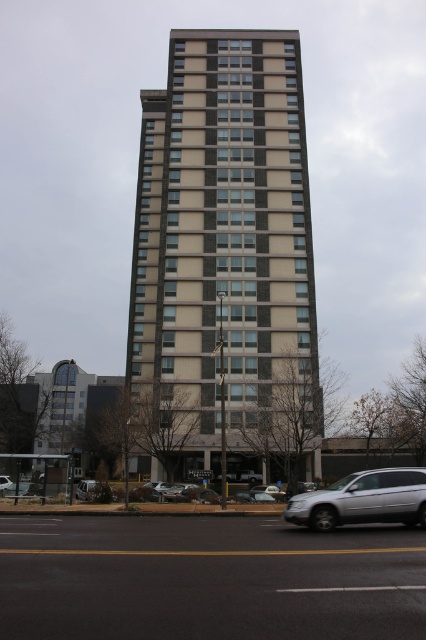
Which is below, metallic silver sedan at lower center or silver metallic suv at lower left?

Positioned lower is metallic silver sedan at lower center.

Can you confirm if metallic silver sedan at lower center is positioned above silver metallic suv at lower left?

No.

What do you see at coordinates (94, 490) in the screenshot? The image size is (426, 640). I see `metallic silver sedan at lower center` at bounding box center [94, 490].

Where is `metallic silver sedan at lower center`? The image size is (426, 640). metallic silver sedan at lower center is located at coordinates coord(94,490).

This screenshot has height=640, width=426. Describe the element at coordinates (362, 499) in the screenshot. I see `silver metallic suv at lower right` at that location.

Between silver metallic suv at lower right and silver metallic suv at lower left, which one has less height?

silver metallic suv at lower left

Describe the element at coordinates (362, 499) in the screenshot. I see `silver metallic suv at lower right` at that location.

This screenshot has height=640, width=426. Find the location of `silver metallic suv at lower right`. silver metallic suv at lower right is located at coordinates (362, 499).

Is point (419, 509) positioned in front of point (98, 486)?

That is True.

Between point (417, 472) and point (109, 492), which one is positioned behind?

Point (109, 492)

Image resolution: width=426 pixels, height=640 pixels. What are the coordinates of `silver metallic suv at lower right` in the screenshot? It's located at (362, 499).